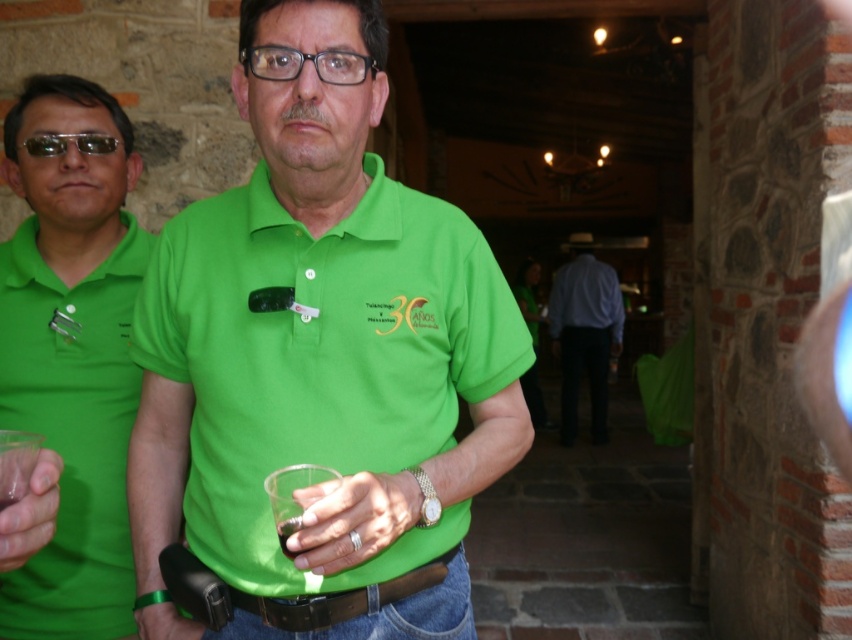
Question: Observing the image, what is the correct spatial positioning of black leather belt at center in reference to black plastic goggles at upper left?

Choices:
 (A) above
 (B) below

Answer: (B)

Question: Observing the image, what is the correct spatial positioning of matte green polo shirt at left in reference to transparent plastic cup at lower left?

Choices:
 (A) left
 (B) right

Answer: (A)

Question: Which object is closer to the camera taking this photo?

Choices:
 (A) green matte shirt at center
 (B) transparent plastic cup at lower left
 (C) black plastic goggles at upper left

Answer: (B)

Question: Which object appears closest to the camera in this image?

Choices:
 (A) matte plastic cup at center
 (B) light blue shirt at center
 (C) black plastic goggles at upper left

Answer: (A)

Question: Which of these objects is positioned closest to the black leather belt at center?

Choices:
 (A) matte plastic cup at center
 (B) black plastic goggles at upper left
 (C) green matte shirt at center

Answer: (A)

Question: Is green matte shirt at center thinner than white cotton shirt at center?

Choices:
 (A) no
 (B) yes

Answer: (B)